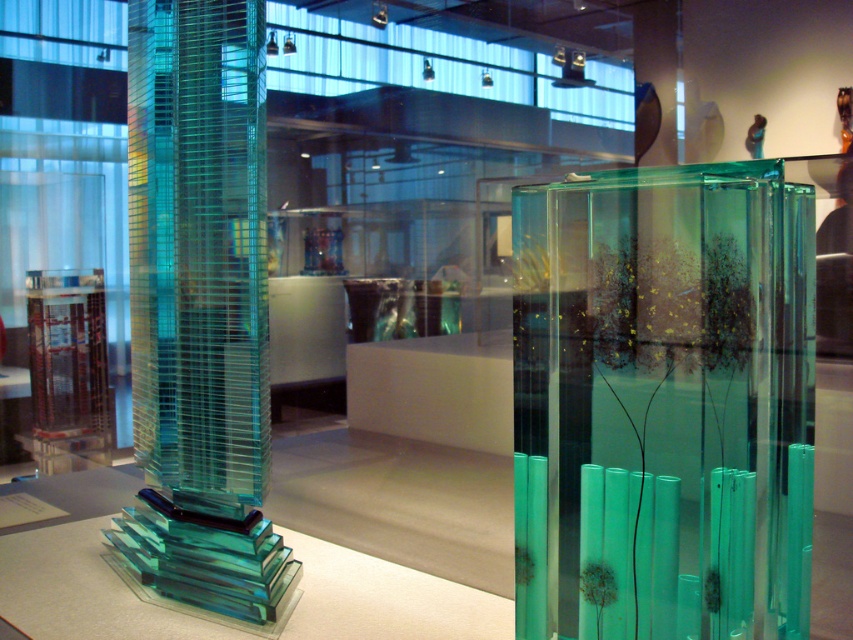
Does transparent glass sculpture at right have a lesser width compared to translucent glass tower at left?

Correct, transparent glass sculpture at right's width is less than translucent glass tower at left's.

Does transparent glass sculpture at right lie behind translucent glass tower at left?

No, transparent glass sculpture at right is in front of translucent glass tower at left.

Is point (712, 241) less distant than point (223, 531)?

Yes.

The width and height of the screenshot is (853, 640). What are the coordinates of `transparent glass sculpture at right` in the screenshot? It's located at (663, 397).

Which is below, translucent glass tower at left or transparent glass table at center?

transparent glass table at center is lower down.

You are a GUI agent. You are given a task and a screenshot of the screen. Output one action in this format:
    pyautogui.click(x=<x>, y=<y>)
    Task: Click on the translucent glass tower at left
    
    Given the screenshot: What is the action you would take?
    pyautogui.click(x=200, y=308)

Locate an element on the screen. translucent glass tower at left is located at coordinates pyautogui.click(x=200, y=308).

At what (x,y) coordinates should I click in order to perform the action: click on translucent glass tower at left. Please return your answer as a coordinate pair (x, y). Looking at the image, I should click on (200, 308).

Is transparent glass sculpture at right to the right of transparent glass table at center from the viewer's perspective?

Yes, transparent glass sculpture at right is to the right of transparent glass table at center.

Consider the image. Between transparent glass sculpture at right and transparent glass table at center, which one has more height?

Standing taller between the two is transparent glass sculpture at right.

Between point (659, 604) and point (299, 620), which one is positioned behind?

The point (299, 620) is more distant.

Find the location of `transparent glass sculpture at right`. transparent glass sculpture at right is located at coordinates (663, 397).